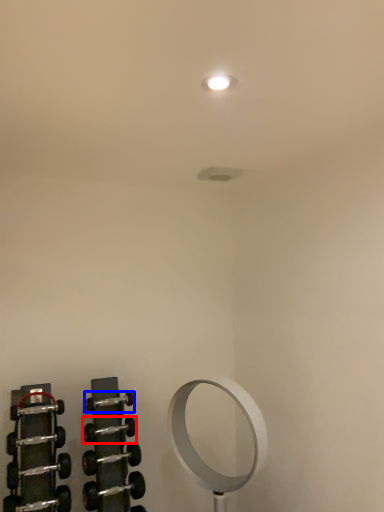
Question: Which object appears farthest to the camera in this image, dumbbell (highlighted by a red box) or dumbbell (highlighted by a blue box)?

Choices:
 (A) dumbbell
 (B) dumbbell

Answer: (B)